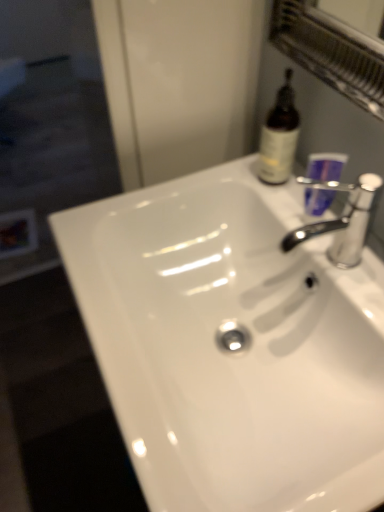
This screenshot has width=384, height=512. Identify the location of silver metallic faucet at upper right. (342, 219).

Find the location of a particular element. The image size is (384, 512). purple plastic cup at upper right is located at coordinates (325, 166).

The image size is (384, 512). What are the coordinates of `transparent glass screen door at left` in the screenshot? It's located at (57, 139).

This screenshot has width=384, height=512. I want to click on sink located on the left of brown glass bottle at upper right, so click(231, 350).

Is brown glass bottle at upper right bigger than white glossy sink at center?

Incorrect, brown glass bottle at upper right is not larger than white glossy sink at center.

From the picture: Considering the sizes of objects brown glass bottle at upper right and white glossy sink at center in the image provided, who is shorter, brown glass bottle at upper right or white glossy sink at center?

Standing shorter between the two is white glossy sink at center.

Is brown glass bottle at upper right in front of or behind white glossy sink at center in the image?

Clearly, brown glass bottle at upper right is behind white glossy sink at center.

Considering the points (330, 198) and (346, 261), which point is behind, point (330, 198) or point (346, 261)?

The point (330, 198) is more distant.

Is purple plastic cup at upper right far away from silver metallic faucet at upper right?

That's not correct — purple plastic cup at upper right is a little close to silver metallic faucet at upper right.

Which of these two, purple plastic cup at upper right or silver metallic faucet at upper right, is wider?

silver metallic faucet at upper right.

I want to click on bottle above the purple plastic cup at upper right (from the image's perspective), so click(279, 136).

Who is bigger, purple plastic cup at upper right or brown glass bottle at upper right?

With larger size is brown glass bottle at upper right.

From the picture: Is purple plastic cup at upper right far away from brown glass bottle at upper right?

No, there isn't a large distance between purple plastic cup at upper right and brown glass bottle at upper right.

Is purple plastic cup at upper right taller than brown glass bottle at upper right?

In fact, purple plastic cup at upper right may be shorter than brown glass bottle at upper right.

Is silver metallic faucet at upper right far away from purple plastic cup at upper right?

No.

From the image's perspective, between silver metallic faucet at upper right and purple plastic cup at upper right, who is located below?

silver metallic faucet at upper right appears lower in the image.

Is silver metallic faucet at upper right completely or partially outside of purple plastic cup at upper right?

Indeed, silver metallic faucet at upper right is completely outside purple plastic cup at upper right.

Can you confirm if silver metallic faucet at upper right is positioned to the right of purple plastic cup at upper right?

No, silver metallic faucet at upper right is not to the right of purple plastic cup at upper right.

Identify the location of tap above the transparent glass screen door at left (from a real-world perspective). This screenshot has height=512, width=384. (342, 219).

Which is more to the right, transparent glass screen door at left or silver metallic faucet at upper right?

silver metallic faucet at upper right.

Is transparent glass screen door at left far away from silver metallic faucet at upper right?

transparent glass screen door at left is positioned a significant distance from silver metallic faucet at upper right.

Is transparent glass screen door at left facing towards silver metallic faucet at upper right?

No, transparent glass screen door at left is not turned towards silver metallic faucet at upper right.

Considering the points (286, 79) and (25, 115), which point is in front, point (286, 79) or point (25, 115)?

The point (286, 79) is closer.

From the image's perspective, which one is positioned lower, brown glass bottle at upper right or transparent glass screen door at left?

brown glass bottle at upper right appears lower in the image.

Based on the photo, from a real-world perspective, is brown glass bottle at upper right physically located above or below transparent glass screen door at left?

Clearly, from a real-world perspective, brown glass bottle at upper right is above transparent glass screen door at left.

Is white glossy sink at center next to silver metallic faucet at upper right?

white glossy sink at center is not next to silver metallic faucet at upper right, and they're not touching.

Which object is closer to the camera taking this photo, white glossy sink at center or silver metallic faucet at upper right?

Positioned in front is white glossy sink at center.

Does white glossy sink at center turn towards silver metallic faucet at upper right?

No, white glossy sink at center is not turned towards silver metallic faucet at upper right.

From a real-world perspective, does white glossy sink at center sit lower than silver metallic faucet at upper right?

Indeed, from a real-world perspective, white glossy sink at center is positioned beneath silver metallic faucet at upper right.

Find the location of `sink that is on the left side of brown glass bottle at upper right`. sink that is on the left side of brown glass bottle at upper right is located at coordinates (231, 350).

Identify the location of tap above the purple plastic cup at upper right (from a real-world perspective). This screenshot has width=384, height=512. (342, 219).

Considering their positions, is purple plastic cup at upper right positioned closer to white glossy sink at center than transparent glass screen door at left?

purple plastic cup at upper right.

Considering their positions, is brown glass bottle at upper right positioned closer to white glossy sink at center than transparent glass screen door at left?

Based on the image, brown glass bottle at upper right appears to be nearer to white glossy sink at center.

When comparing their distances from transparent glass screen door at left, does white glossy sink at center or brown glass bottle at upper right seem further?

Among the two, brown glass bottle at upper right is located further to transparent glass screen door at left.

From the image, which object appears to be farther from transparent glass screen door at left, white glossy sink at center or silver metallic faucet at upper right?

The object further to transparent glass screen door at left is silver metallic faucet at upper right.

Looking at the image, which one is located further to silver metallic faucet at upper right, transparent glass screen door at left or purple plastic cup at upper right?

Among the two, transparent glass screen door at left is located further to silver metallic faucet at upper right.

Looking at the image, which one is located further to purple plastic cup at upper right, white glossy sink at center or brown glass bottle at upper right?

The object further to purple plastic cup at upper right is white glossy sink at center.

Which object lies further to the anchor point brown glass bottle at upper right, white glossy sink at center or transparent glass screen door at left?

The object further to brown glass bottle at upper right is transparent glass screen door at left.

When comparing their distances from transparent glass screen door at left, does purple plastic cup at upper right or white glossy sink at center seem closer?

Based on the image, white glossy sink at center appears to be nearer to transparent glass screen door at left.

This screenshot has height=512, width=384. What are the coordinates of `bottle between silver metallic faucet at upper right and transparent glass screen door at left from front to back` in the screenshot? It's located at click(279, 136).

Identify the location of mouthwash between brown glass bottle at upper right and silver metallic faucet at upper right in the vertical direction. Image resolution: width=384 pixels, height=512 pixels. (325, 166).

Identify the location of tap between white glossy sink at center and transparent glass screen door at left from front to back. This screenshot has width=384, height=512. (342, 219).

This screenshot has height=512, width=384. I want to click on tap between brown glass bottle at upper right and white glossy sink at center in the up-down direction, so click(x=342, y=219).